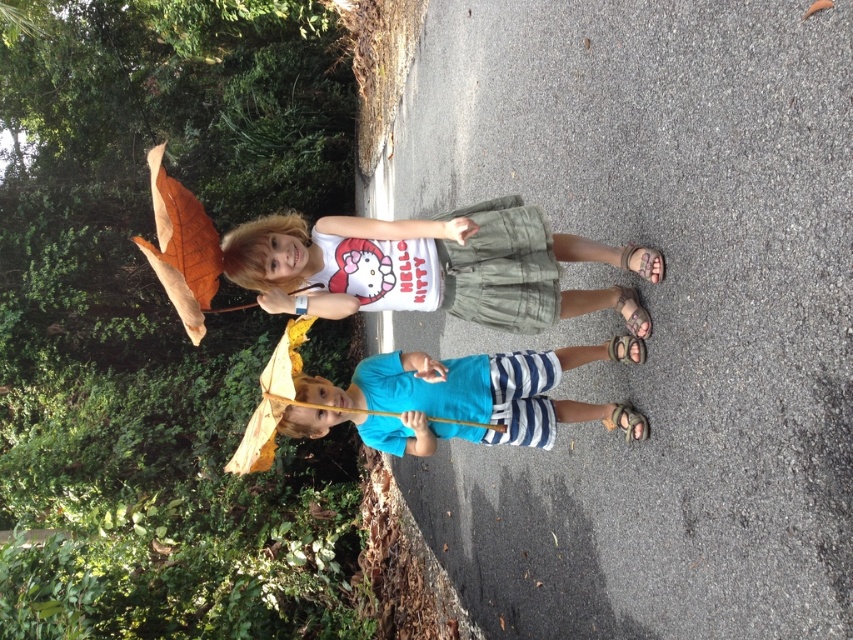
Find the location of a particular element. The image size is (853, 640). white cotton shirt at center is located at coordinates (433, 266).

This screenshot has height=640, width=853. What do you see at coordinates (433, 266) in the screenshot? I see `white cotton shirt at center` at bounding box center [433, 266].

Is point (608, 259) positioned before point (399, 372)?

Yes, point (608, 259) is closer to viewer.

Where is `white cotton shirt at center`? This screenshot has height=640, width=853. white cotton shirt at center is located at coordinates pyautogui.click(x=433, y=266).